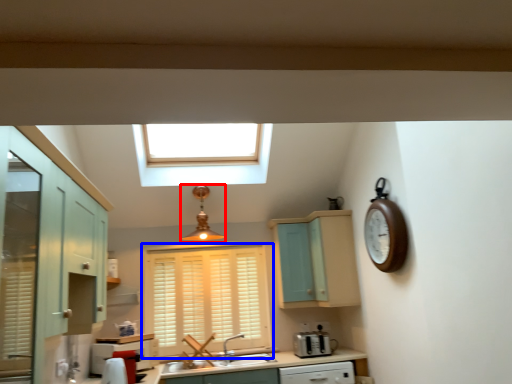
Question: Which of the following is the farthest to the observer, light fixture (highlighted by a red box) or window (highlighted by a blue box)?

Choices:
 (A) light fixture
 (B) window

Answer: (B)